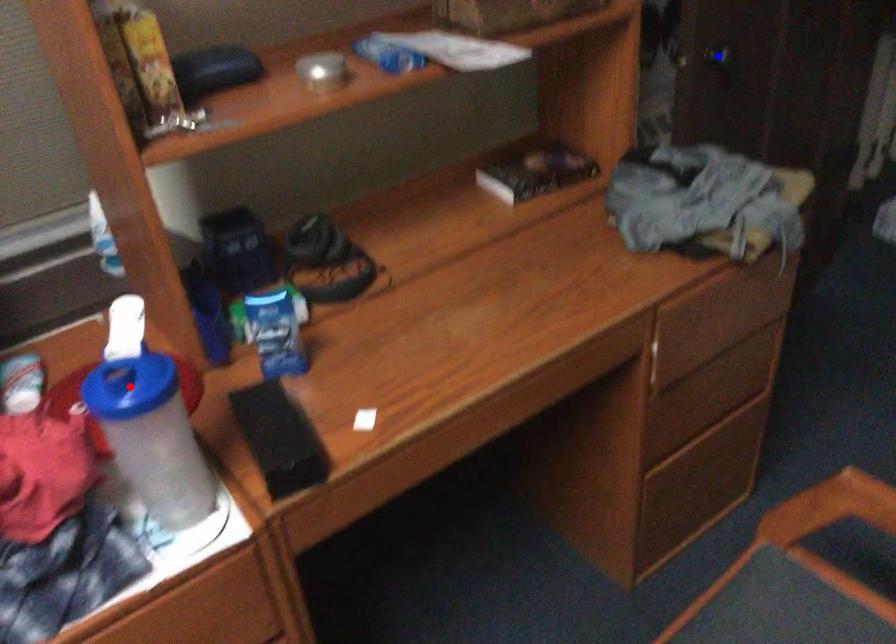
Question: Two points are marked on the image. Which point is closer to the camera?

Choices:
 (A) Blue point is closer.
 (B) Red point is closer.

Answer: (B)